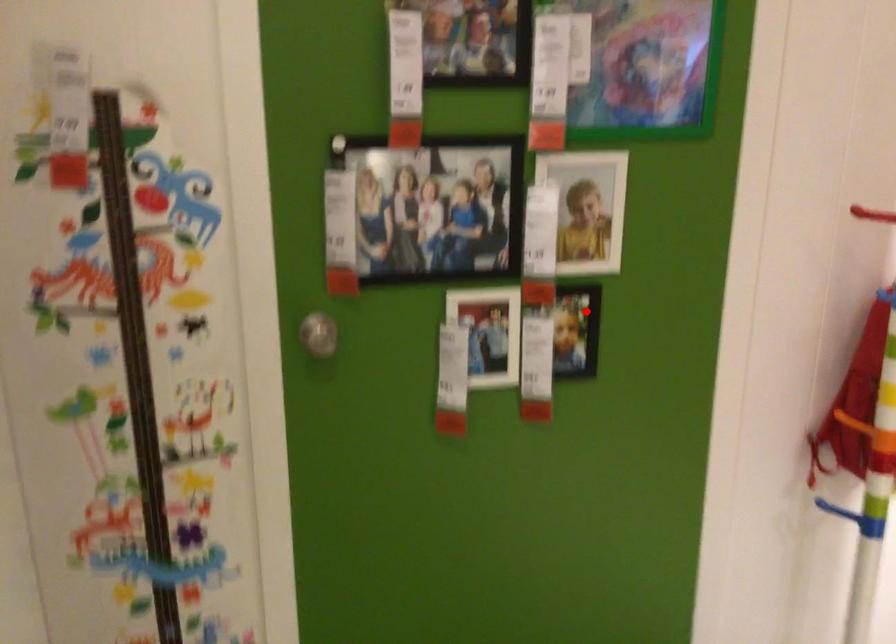
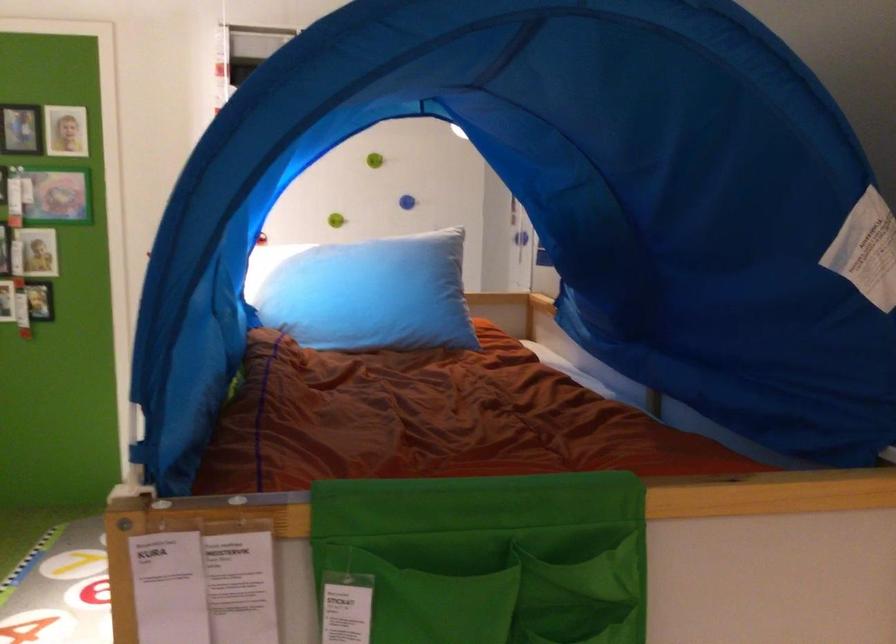
Find the pixel in the second image that matches the highlighted location in the first image.

(39, 301)